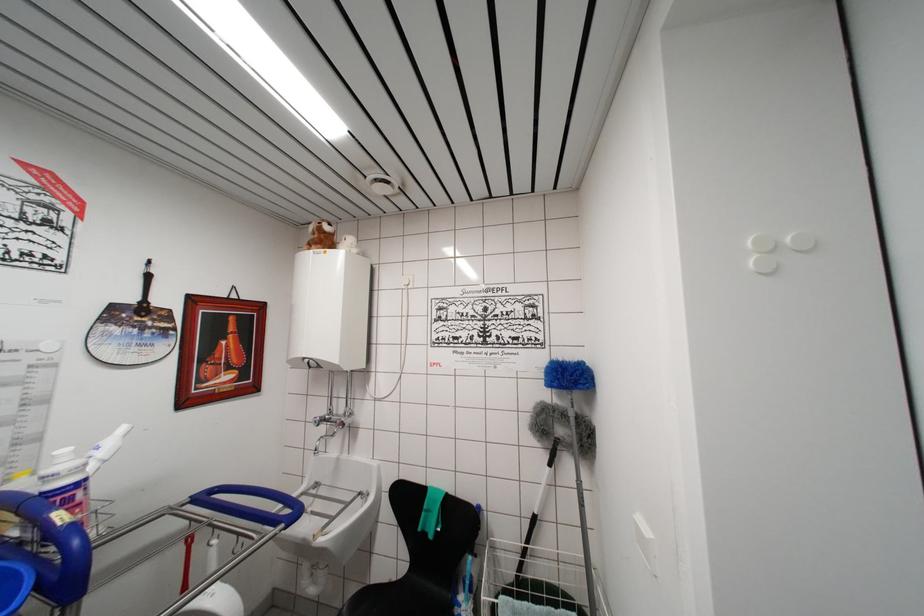
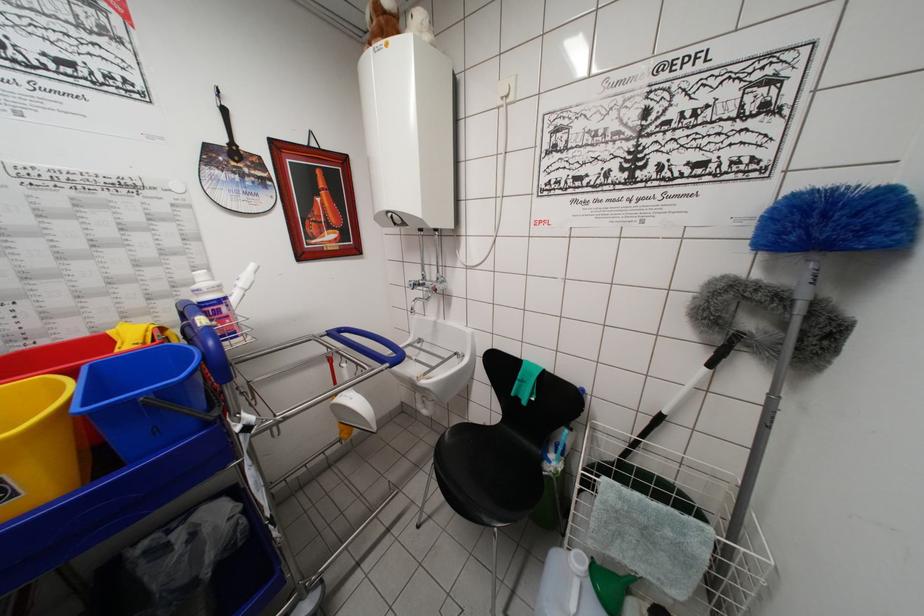
Find the pixel in the second image that matches [329,237] in the first image.

(387, 17)